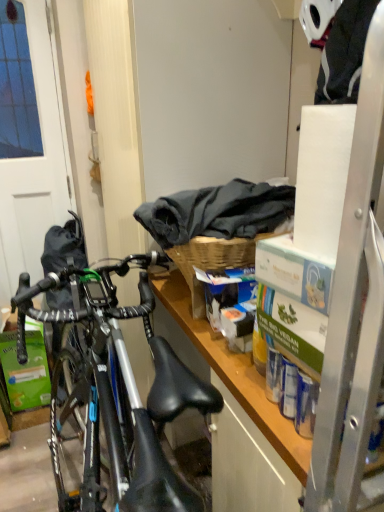
Question: Considering the relative positions of woven wood picnic basket at center and matte white screen door at left in the image provided, is woven wood picnic basket at center behind matte white screen door at left?

Choices:
 (A) yes
 (B) no

Answer: (B)

Question: From a real-world perspective, is woven wood picnic basket at center located beneath matte white screen door at left?

Choices:
 (A) no
 (B) yes

Answer: (A)

Question: From a real-world perspective, is woven wood picnic basket at center on matte white screen door at left?

Choices:
 (A) no
 (B) yes

Answer: (B)

Question: Is woven wood picnic basket at center not close to matte white screen door at left?

Choices:
 (A) no
 (B) yes

Answer: (B)

Question: Does woven wood picnic basket at center have a larger size compared to matte white screen door at left?

Choices:
 (A) yes
 (B) no

Answer: (B)

Question: Does woven wood picnic basket at center have a smaller size compared to matte white screen door at left?

Choices:
 (A) yes
 (B) no

Answer: (A)

Question: Can woven wood picnic basket at center be found inside matte white screen door at left?

Choices:
 (A) yes
 (B) no

Answer: (B)

Question: Can you confirm if matte white screen door at left is wider than woven wood picnic basket at center?

Choices:
 (A) yes
 (B) no

Answer: (B)

Question: From the image's perspective, is matte white screen door at left beneath woven wood picnic basket at center?

Choices:
 (A) no
 (B) yes

Answer: (A)

Question: From a real-world perspective, is matte white screen door at left below woven wood picnic basket at center?

Choices:
 (A) yes
 (B) no

Answer: (A)

Question: Does matte white screen door at left have a greater height compared to woven wood picnic basket at center?

Choices:
 (A) yes
 (B) no

Answer: (A)

Question: Does matte white screen door at left lie behind woven wood picnic basket at center?

Choices:
 (A) no
 (B) yes

Answer: (B)

Question: Is dark gray fabric at upper center at the back of woven wood picnic basket at center?

Choices:
 (A) yes
 (B) no

Answer: (B)